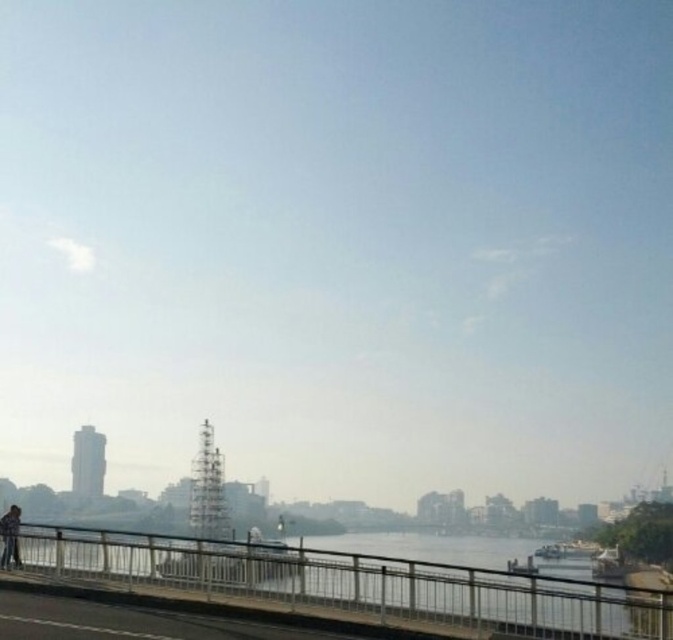
Which of these two, metallic silver railing at lower center or dark blue jeans at lower left, stands shorter?

With less height is dark blue jeans at lower left.

Locate an element on the screen. metallic silver railing at lower center is located at coordinates (357, 582).